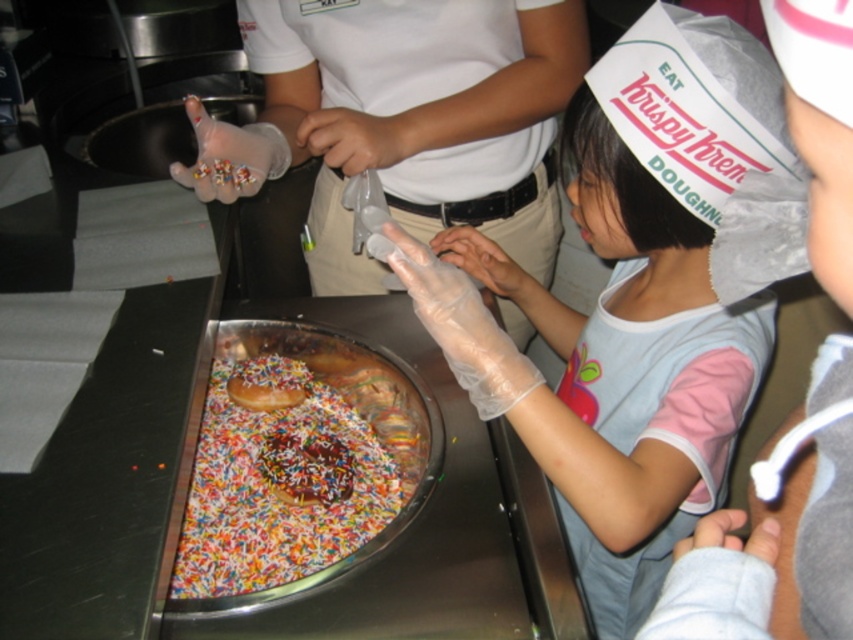
You are a customer at the Krispy Kreme shop and you want to grab the glazed chocolate donut at center. However, there is a transparent plastic glove at upper center in the way. Can you reach the donut without moving the glove?

The transparent plastic glove at upper center is above the glazed chocolate donut at center, so you can reach the donut by moving your hand under the glove.

You are a customer at Krispy Kreme and you want to grab a colorful sprinkled donuts at center. However, there is a transparent plastic glove at upper center in the way. Can you reach the donuts without moving the glove?

The transparent plastic glove at upper center is positioned over colorful sprinkled donuts at center, so you cannot reach the donuts without moving the glove.

You are a worker at Krispy Kreme and need to place both the transparent plastic glove at upper center and the colorful sprinkled donuts at center into a storage box. The box can only fit items that are narrower than 15 centimeters. Based on their widths, can both items fit inside the box?

The transparent plastic glove at upper center is wider than the colorful sprinkled donuts at center. However, since the box requires items to be narrower than 15 centimeters, we need to know each item width. The description only states the glove is wider than the donuts but does not provide exact measurements. Therefore, it is impossible to determine if both items will fit without knowing their exact widths.